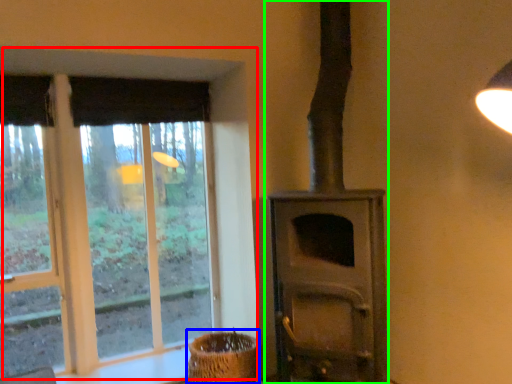
Question: Estimate the real-world distances between objects in this image. Which object is closer to window (highlighted by a red box), basket (highlighted by a blue box) or wood burning stove (highlighted by a green box)?

Choices:
 (A) basket
 (B) wood burning stove

Answer: (A)